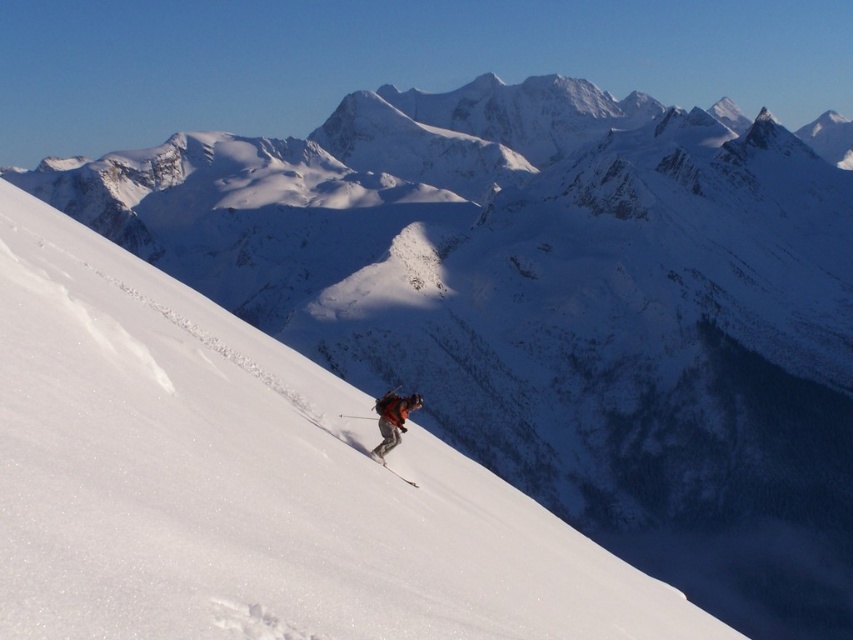
You are analyzing the skier image. There are two points marked in the scene. The first point is at coordinates point (157, 595) and the second is at point (405, 483). From your perspective, which point is closer to you?

Point (157, 595) is closer to the camera than point (405, 483).